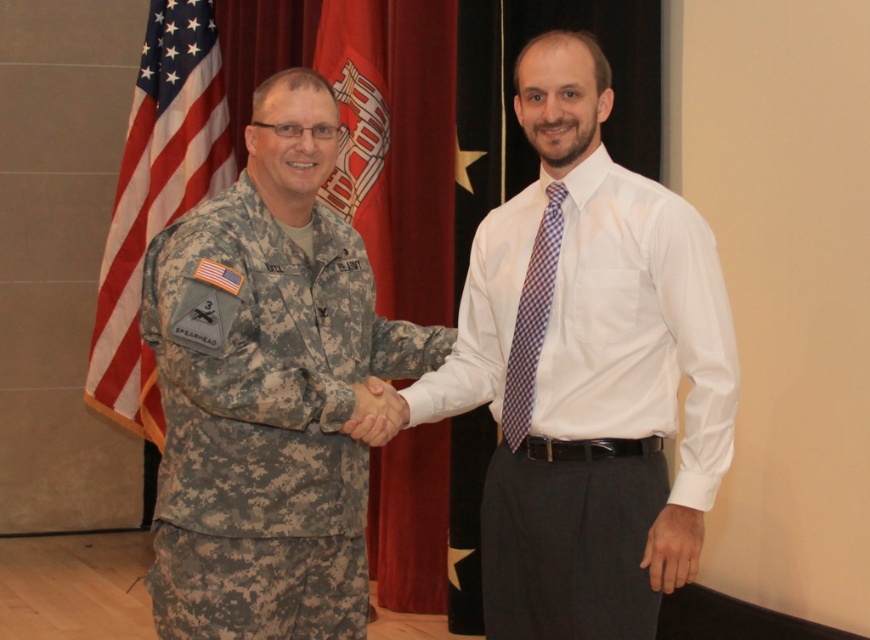
Question: Is white glossy shirt at center to the left of white matte hand at center from the viewer's perspective?

Choices:
 (A) yes
 (B) no

Answer: (B)

Question: Considering the relative positions of american flag at left and purple checkered tie at center in the image provided, where is american flag at left located with respect to purple checkered tie at center?

Choices:
 (A) left
 (B) right

Answer: (A)

Question: Which of the following is the closest to the observer?

Choices:
 (A) white matte hand at center
 (B) white glossy shirt at center
 (C) american flag at left
 (D) red fabric flag at center

Answer: (B)

Question: Is camouflage fabric uniform at center to the left of white matte hand at center from the viewer's perspective?

Choices:
 (A) no
 (B) yes

Answer: (B)

Question: Among these objects, which one is nearest to the camera?

Choices:
 (A) red fabric flag at center
 (B) camouflage fabric uniform at center
 (C) white matte hand at center
 (D) purple checkered tie at center

Answer: (B)

Question: Which object is the farthest from the american flag at left?

Choices:
 (A) camouflage fabric uniform at center
 (B) red fabric flag at center
 (C) white glossy shirt at center

Answer: (C)